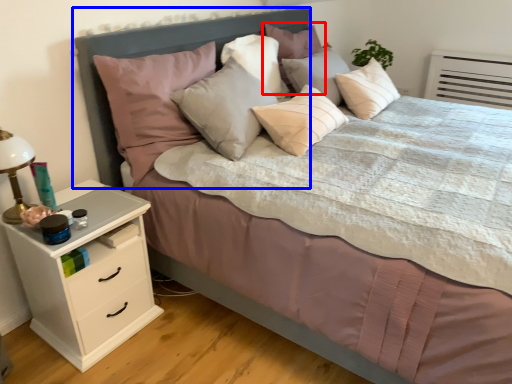
Question: Which point is closer to the camera, pillow (highlighted by a red box) or headboard (highlighted by a blue box)?

Choices:
 (A) pillow
 (B) headboard

Answer: (B)